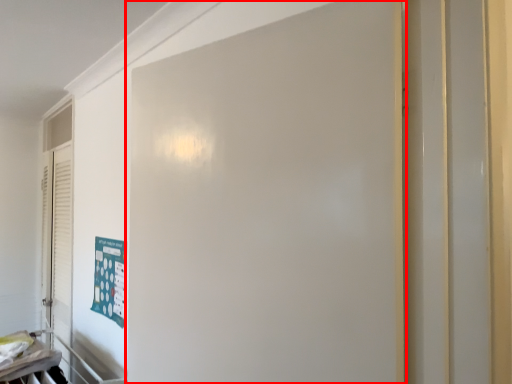
Question: From the image, what is the correct spatial relationship of door (annotated by the red box) in relation to poster?

Choices:
 (A) left
 (B) right

Answer: (B)